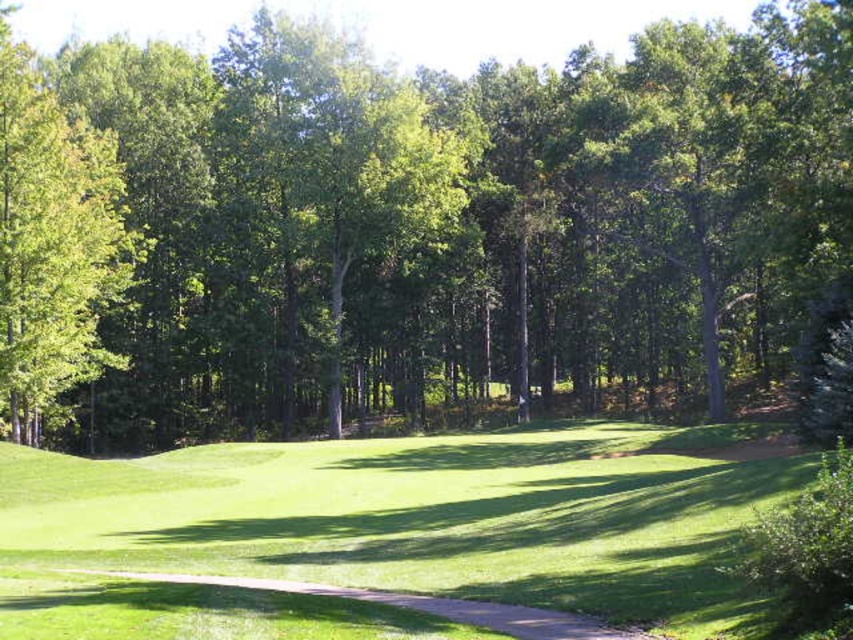
You are standing at the center of the golf course and see a point marked at (53,244). What object is located at that point?

The green leafy tree at left is located at point (53,244).

You are a golfer standing at the starting point of the golf course. You see two points marked on the map as point 1 at coordinates point (x=4, y=33) and point 2 at coordinates point (x=329, y=589). Which point is closer to your current position?

Point (x=4, y=33) is closer to your current position because it is further to the viewer than point (x=329, y=589), meaning it is physically nearer to you.

You are a golfer standing at the bottom left of the image, looking towards the center. You see the green leafy tree at center and the green grassy golf course at center. Which object is taller?

The green leafy tree at center is taller than the green grassy golf course at center according to the description.